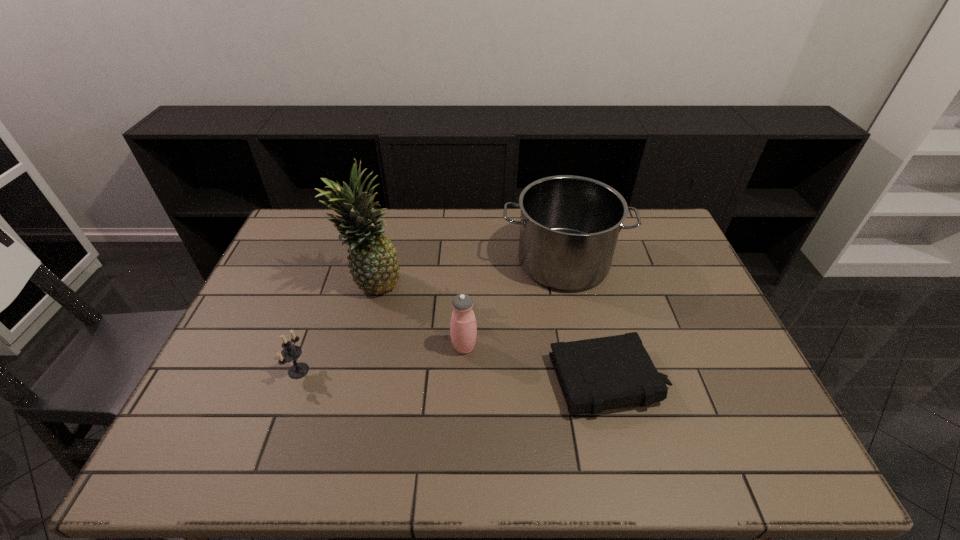
Identify which object is the closest to the thermos bottle. Please provide its 2D coordinates. Your answer should be formatted as a tuple, i.e. [(x, y)], where the tuple contains the x and y coordinates of a point satisfying the conditions above.

[(569, 225)]

I want to click on the second closest object to the thermos bottle, so click(x=597, y=374).

Where is `free spot that satisfies the following two spatial constraints: 1. on the front side of the tallest object; 2. on the right side of the third object from left to right`? free spot that satisfies the following two spatial constraints: 1. on the front side of the tallest object; 2. on the right side of the third object from left to right is located at coordinates (356, 347).

This screenshot has width=960, height=540. I want to click on free location that satisfies the following two spatial constraints: 1. on the back side of the candle holder; 2. on the left side of the third tallest object, so click(307, 347).